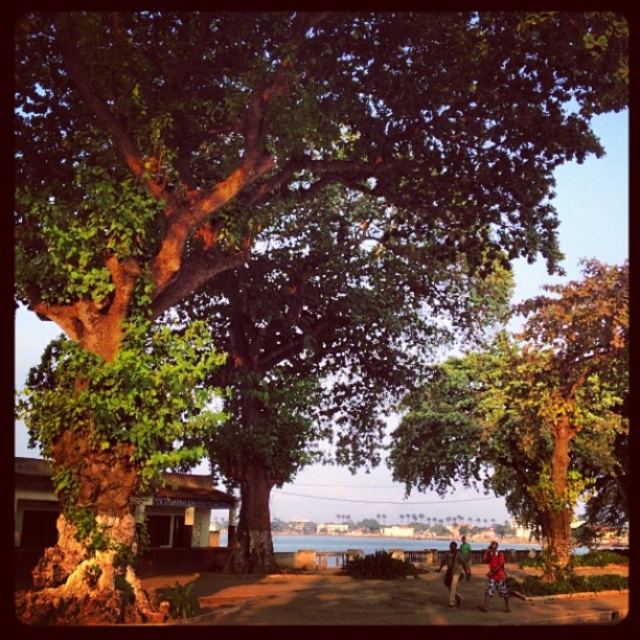
Question: Which of the following is the closest to the observer?

Choices:
 (A) brown textured shirt at lower right
 (B) green fabric shirt at lower right

Answer: (A)

Question: Which point is farther to the camera?

Choices:
 (A) brown textured shirt at lower right
 (B) green leafy tree at center
 (C) green fabric shirt at lower right

Answer: (B)

Question: Does green leafy tree at center have a greater width compared to red fabric person at lower right?

Choices:
 (A) no
 (B) yes

Answer: (B)

Question: Which point is farther to the camera?

Choices:
 (A) brown textured shirt at lower right
 (B) green leafy tree at center

Answer: (B)

Question: Does brown textured shirt at lower right appear under green fabric shirt at lower right?

Choices:
 (A) yes
 (B) no

Answer: (B)

Question: Is green leafy tree at center above red fabric person at lower right?

Choices:
 (A) no
 (B) yes

Answer: (B)